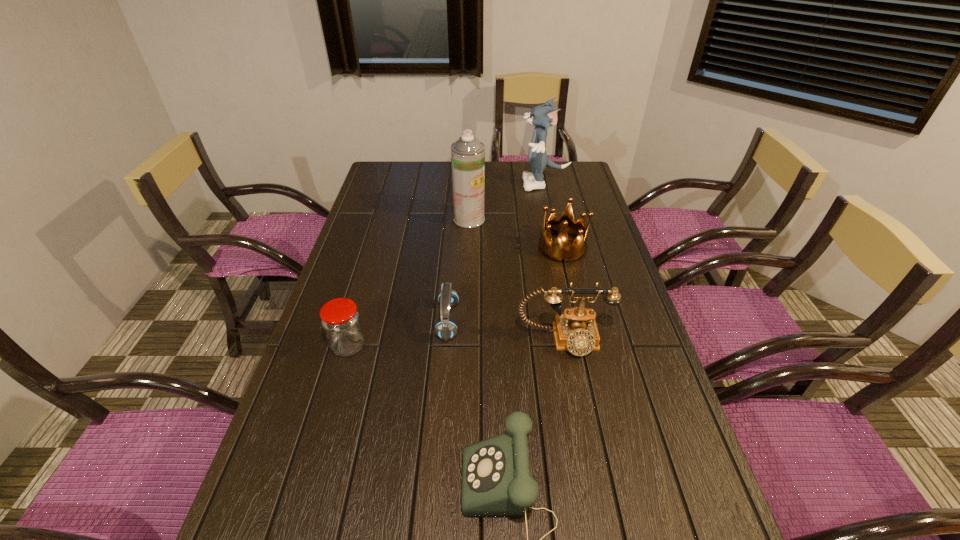
The height and width of the screenshot is (540, 960). I want to click on free location located on the dial number of the taller telephone, so click(597, 512).

This screenshot has height=540, width=960. I want to click on vacant space situated on the front of the third farthest object, so click(587, 352).

At what (x,y) coordinates should I click in order to perform the action: click on free spot located on the front of the jar. Please return your answer as a coordinate pair (x, y). This screenshot has height=540, width=960. Looking at the image, I should click on (328, 416).

Where is `vacant area situated 0.100m on the ear cups of the headset`? Image resolution: width=960 pixels, height=540 pixels. vacant area situated 0.100m on the ear cups of the headset is located at coordinates (494, 321).

You are a GUI agent. You are given a task and a screenshot of the screen. Output one action in this format:
    pyautogui.click(x=<x>, y=<y>)
    Task: Click on the object that is at the far edge
    This screenshot has height=540, width=960.
    Given the screenshot: What is the action you would take?
    pyautogui.click(x=543, y=116)

Identify the location of object located at the left edge. This screenshot has height=540, width=960. (x=340, y=319).

You are a GUI agent. You are given a task and a screenshot of the screen. Output one action in this format:
    pyautogui.click(x=<x>, y=<y>)
    Task: Click on the cat that is at the right edge
    The image size is (960, 540).
    Given the screenshot: What is the action you would take?
    pyautogui.click(x=543, y=116)

Locate an element on the screen. This screenshot has width=960, height=540. telephone that is at the right edge is located at coordinates (576, 330).

Where is `crown located in the right edge section of the desktop`? This screenshot has height=540, width=960. crown located in the right edge section of the desktop is located at coordinates (560, 250).

Identify the location of object located in the far right corner section of the desktop. (543, 116).